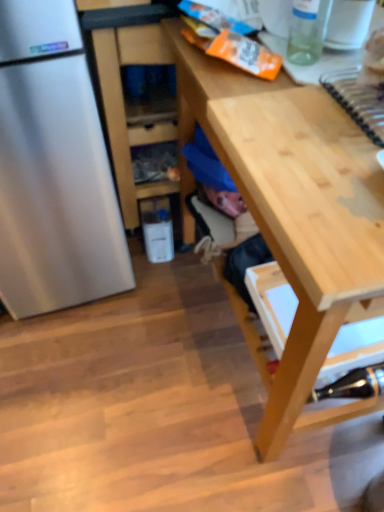
The width and height of the screenshot is (384, 512). Describe the element at coordinates (354, 384) in the screenshot. I see `metallic silver stapler at lower right, positioned as the first bottle in bottom-to-top order` at that location.

What are the coordinates of `transparent glass bottle at upper right, which ranks as the first bottle in top-to-bottom order` in the screenshot? It's located at (307, 30).

The width and height of the screenshot is (384, 512). What are the coordinates of `wooden cabinet at center` in the screenshot? It's located at (121, 84).

From a real-world perspective, is light wood desk at center physically below transparent glass bottle at upper right, the second bottle from the right?

Yes, from a real-world perspective, light wood desk at center is below transparent glass bottle at upper right, the second bottle from the right.

Based on the photo, can you confirm if light wood desk at center is shorter than transparent glass bottle at upper right, which is the 1th bottle in left-to-right order?

Incorrect, the height of light wood desk at center does not fall short of that of transparent glass bottle at upper right, which is the 1th bottle in left-to-right order.

From the image's perspective, is light wood desk at center above or below transparent glass bottle at upper right, which ranks as the first bottle in top-to-bottom order?

Clearly, from the image's perspective, light wood desk at center is below transparent glass bottle at upper right, which ranks as the first bottle in top-to-bottom order.

Locate an element on the screen. This screenshot has height=512, width=384. desk that appears in front of the transparent glass bottle at upper right, the second bottle from the right is located at coordinates (294, 206).

Which of these two, metallic silver stapler at lower right, the 1th bottle viewed from the right, or light wood desk at center, is bigger?

light wood desk at center is bigger.

Is metallic silver stapler at lower right, which is counted as the 1th bottle, starting from the back, beside light wood desk at center?

No, metallic silver stapler at lower right, which is counted as the 1th bottle, starting from the back, is not in contact with light wood desk at center.

From the picture: Considering the relative sizes of metallic silver stapler at lower right, positioned as the first bottle in bottom-to-top order, and light wood desk at center in the image provided, is metallic silver stapler at lower right, positioned as the first bottle in bottom-to-top order, taller than light wood desk at center?

In fact, metallic silver stapler at lower right, positioned as the first bottle in bottom-to-top order, may be shorter than light wood desk at center.

Is transparent glass bottle at upper right, which is the 1th bottle in left-to-right order, positioned behind metallic silver stapler at lower right, which ranks as the 2th bottle in front-to-back order?

No, transparent glass bottle at upper right, which is the 1th bottle in left-to-right order, is closer to the viewer.

Which is nearer, (317, 49) or (378, 365)?

Point (317, 49) is closer to the camera than point (378, 365).

From the image's perspective, which object appears higher, transparent glass bottle at upper right, which is the 1th bottle in left-to-right order, or metallic silver stapler at lower right, acting as the 2th bottle starting from the left?

transparent glass bottle at upper right, which is the 1th bottle in left-to-right order.

Can you confirm if transparent glass bottle at upper right, the second bottle from the right, is wider than metallic silver stapler at lower right, positioned as the first bottle in bottom-to-top order?

No, transparent glass bottle at upper right, the second bottle from the right, is not wider than metallic silver stapler at lower right, positioned as the first bottle in bottom-to-top order.

From the picture: From the image's perspective, is light wood desk at center below metallic silver stapler at lower right, positioned as the first bottle in bottom-to-top order?

Incorrect, from the image's perspective, light wood desk at center is higher than metallic silver stapler at lower right, positioned as the first bottle in bottom-to-top order.

Which of these two, light wood desk at center or metallic silver stapler at lower right, which is counted as the 1th bottle, starting from the back, is wider?

Answer: light wood desk at center.

From a real-world perspective, is light wood desk at center positioned above or below metallic silver stapler at lower right, which ranks as the 2th bottle in front-to-back order?

light wood desk at center is above metallic silver stapler at lower right, which ranks as the 2th bottle in front-to-back order.

Is light wood desk at center aimed at metallic silver stapler at lower right, the 1th bottle viewed from the right?

No, light wood desk at center is not turned towards metallic silver stapler at lower right, the 1th bottle viewed from the right.

Is wooden cabinet at center aimed at metallic silver stapler at lower right, acting as the 2th bottle starting from the left?

Yes, wooden cabinet at center faces towards metallic silver stapler at lower right, acting as the 2th bottle starting from the left.

Between wooden cabinet at center and metallic silver stapler at lower right, which is counted as the 1th bottle, starting from the back, which one has larger size?

With larger size is wooden cabinet at center.

From a real-world perspective, between wooden cabinet at center and metallic silver stapler at lower right, which appears as the second bottle when viewed from the top, who is vertically lower?

metallic silver stapler at lower right, which appears as the second bottle when viewed from the top, from a real-world perspective.

Consider the image. From the image's perspective, who appears lower, wooden cabinet at center or metallic silver stapler at lower right, which ranks as the 2th bottle in front-to-back order?

metallic silver stapler at lower right, which ranks as the 2th bottle in front-to-back order, from the image's perspective.

Between transparent glass bottle at upper right, the 2th bottle positioned from the bottom, and wooden cabinet at center, which one has larger size?

Bigger between the two is wooden cabinet at center.

Image resolution: width=384 pixels, height=512 pixels. Identify the location of bottle that is the 1st object located below the wooden cabinet at center (from the image's perspective). (307, 30).

Is transparent glass bottle at upper right, the 2th bottle positioned from the bottom, to the right of wooden cabinet at center from the viewer's perspective?

Yes, transparent glass bottle at upper right, the 2th bottle positioned from the bottom, is to the right of wooden cabinet at center.

Which is in front, transparent glass bottle at upper right, which is the 1th bottle in left-to-right order, or wooden cabinet at center?

transparent glass bottle at upper right, which is the 1th bottle in left-to-right order, is closer to the camera.

Who is bigger, metallic silver stapler at lower right, which is counted as the 1th bottle, starting from the back, or wooden cabinet at center?

wooden cabinet at center.

Which point is more distant from viewer, (x=380, y=366) or (x=150, y=26)?

Point (x=150, y=26)

Is metallic silver stapler at lower right, which appears as the second bottle when viewed from the top, oriented towards wooden cabinet at center?

No, metallic silver stapler at lower right, which appears as the second bottle when viewed from the top, is not turned towards wooden cabinet at center.

Identify the location of desk below the transparent glass bottle at upper right, the 2th bottle positioned from the bottom (from the image's perspective). The height and width of the screenshot is (512, 384). (294, 206).

Where is `desk located above the metallic silver stapler at lower right, which appears as the second bottle when viewed from the top (from the image's perspective)`? The height and width of the screenshot is (512, 384). desk located above the metallic silver stapler at lower right, which appears as the second bottle when viewed from the top (from the image's perspective) is located at coordinates (294, 206).

Based on their spatial positions, is light wood desk at center or transparent glass bottle at upper right, the second bottle from the right, closer to wooden cabinet at center?

light wood desk at center.

Consider the image. Estimate the real-world distances between objects in this image. Which object is closer to light wood desk at center, wooden cabinet at center or metallic silver stapler at lower right, acting as the 2th bottle starting from the left?

Among the two, wooden cabinet at center is located nearer to light wood desk at center.

When comparing their distances from transparent glass bottle at upper right, which ranks as the first bottle in top-to-bottom order, does metallic silver stapler at lower right, acting as the 2th bottle starting from the left, or light wood desk at center seem further?

Based on the image, metallic silver stapler at lower right, acting as the 2th bottle starting from the left, appears to be further to transparent glass bottle at upper right, which ranks as the first bottle in top-to-bottom order.

Based on their spatial positions, is light wood desk at center or metallic silver stapler at lower right, the 1th bottle viewed from the right, closer to wooden cabinet at center?

light wood desk at center is closer to wooden cabinet at center.

Based on their spatial positions, is metallic silver stapler at lower right, which ranks as the 2th bottle in front-to-back order, or wooden cabinet at center further from light wood desk at center?

Based on the image, metallic silver stapler at lower right, which ranks as the 2th bottle in front-to-back order, appears to be further to light wood desk at center.

Looking at the image, which one is located closer to metallic silver stapler at lower right, positioned as the first bottle in bottom-to-top order, wooden cabinet at center or light wood desk at center?

Among the two, light wood desk at center is located nearer to metallic silver stapler at lower right, positioned as the first bottle in bottom-to-top order.

Looking at the image, which one is located further to metallic silver stapler at lower right, positioned as the first bottle in bottom-to-top order, light wood desk at center or wooden cabinet at center?

wooden cabinet at center.

Estimate the real-world distances between objects in this image. Which object is further from wooden cabinet at center, metallic silver stapler at lower right, the 1th bottle viewed from the right, or light wood desk at center?

metallic silver stapler at lower right, the 1th bottle viewed from the right, is further to wooden cabinet at center.

Find the location of `desk between wooden cabinet at center and metallic silver stapler at lower right, positioned as the first bottle in bottom-to-top order, in the vertical direction`. desk between wooden cabinet at center and metallic silver stapler at lower right, positioned as the first bottle in bottom-to-top order, in the vertical direction is located at coordinates (294, 206).

I want to click on desk that lies between transparent glass bottle at upper right, which ranks as the first bottle in top-to-bottom order, and metallic silver stapler at lower right, the 1th bottle viewed from the right, from top to bottom, so click(294, 206).

The width and height of the screenshot is (384, 512). What are the coordinates of `bottle between wooden cabinet at center and metallic silver stapler at lower right, which is counted as the 1th bottle, starting from the back, vertically` in the screenshot? It's located at (307, 30).